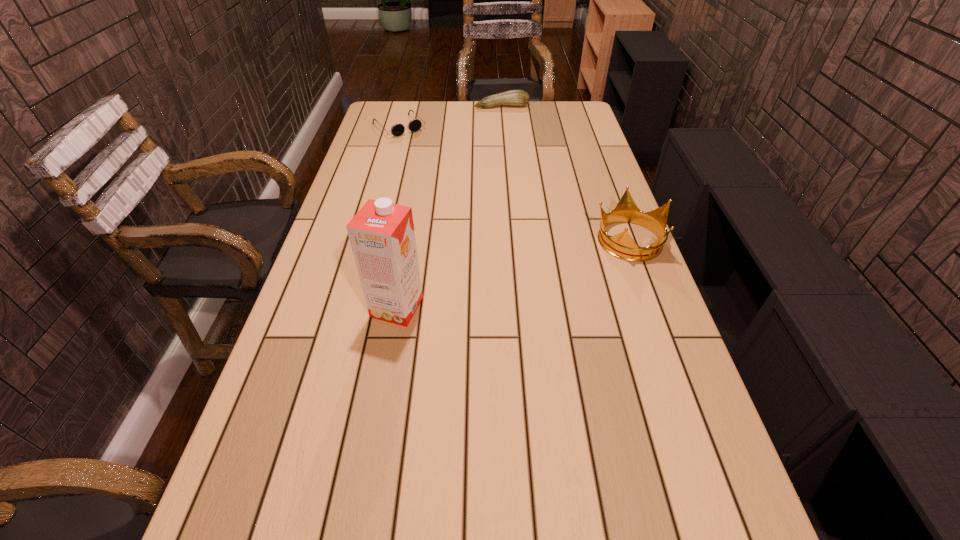
You are a GUI agent. You are given a task and a screenshot of the screen. Output one action in this format:
    pyautogui.click(x=<x>, y=<y>)
    Task: Click on the nearest object
    This screenshot has height=540, width=960.
    Given the screenshot: What is the action you would take?
    (382, 237)

Identify the location of carton. The width and height of the screenshot is (960, 540). (382, 237).

Find the location of a particular element. crown is located at coordinates (622, 246).

Where is `the second nearest object`? Image resolution: width=960 pixels, height=540 pixels. the second nearest object is located at coordinates (622, 246).

The height and width of the screenshot is (540, 960). In order to click on the second farthest object in this screenshot , I will do `click(414, 125)`.

The height and width of the screenshot is (540, 960). I want to click on the shortest object, so click(414, 125).

At what (x,y) coordinates should I click in order to perform the action: click on zucchini. Please return your answer as a coordinate pair (x, y). This screenshot has height=540, width=960. Looking at the image, I should click on (518, 98).

Locate an element on the screen. the farthest object is located at coordinates (518, 98).

The width and height of the screenshot is (960, 540). In order to click on vacant space situated 0.090m on the back of the tallest object in this screenshot , I will do `click(404, 266)`.

The width and height of the screenshot is (960, 540). Find the location of `free point located 0.190m on the back of the second tallest object`. free point located 0.190m on the back of the second tallest object is located at coordinates (609, 184).